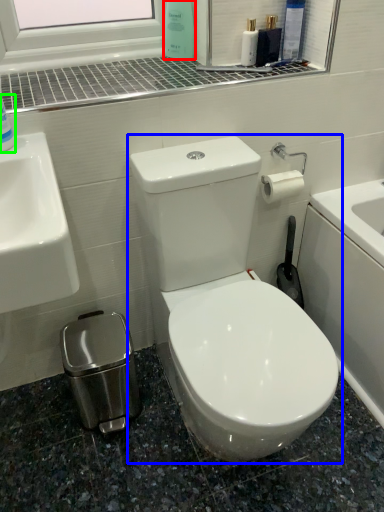
Question: Which object is positioned closest to cleaning product (highlighted by a red box)? Select from toilet (highlighted by a blue box) and cleaning product (highlighted by a green box).

Choices:
 (A) toilet
 (B) cleaning product

Answer: (B)